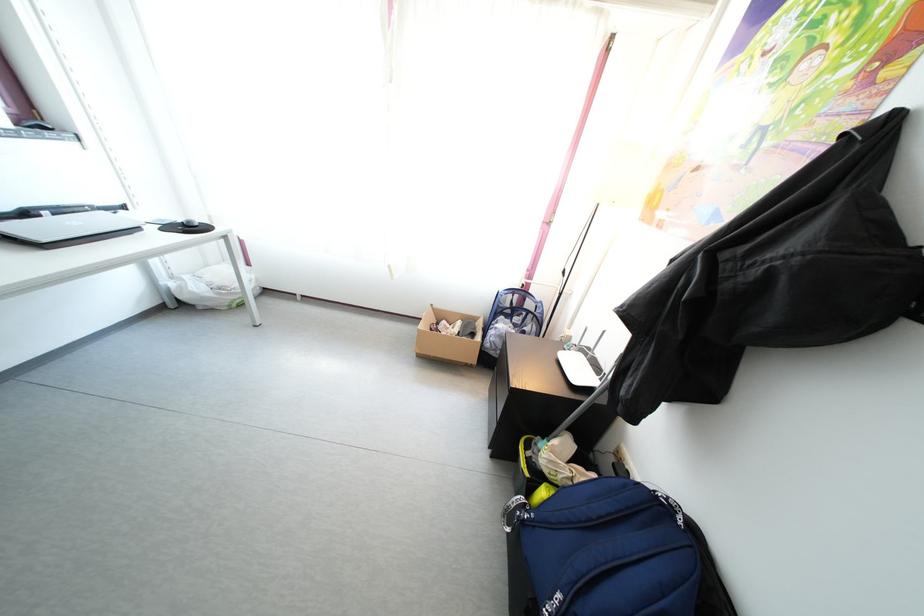
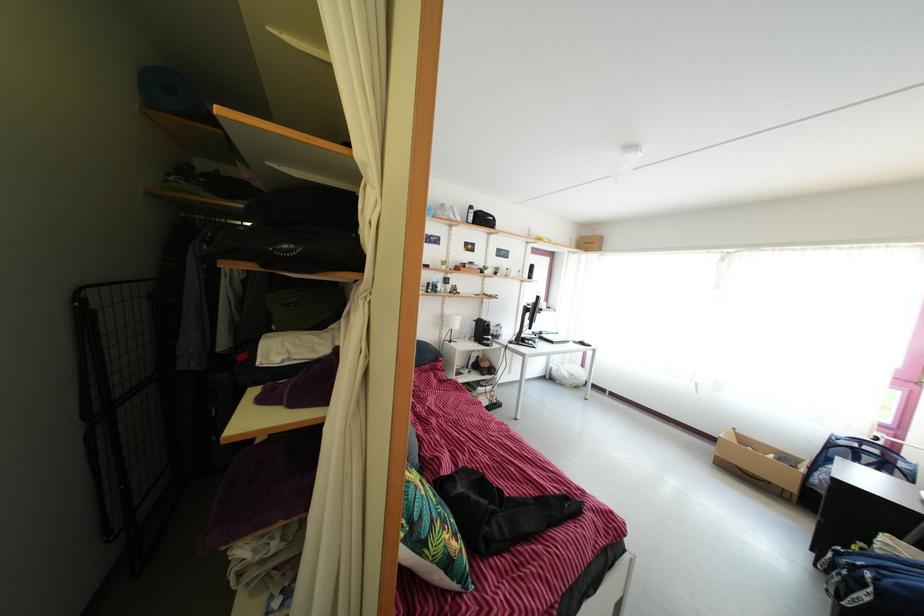
In the second image, find the point that corresponds to (494,353) in the first image.

(821, 488)